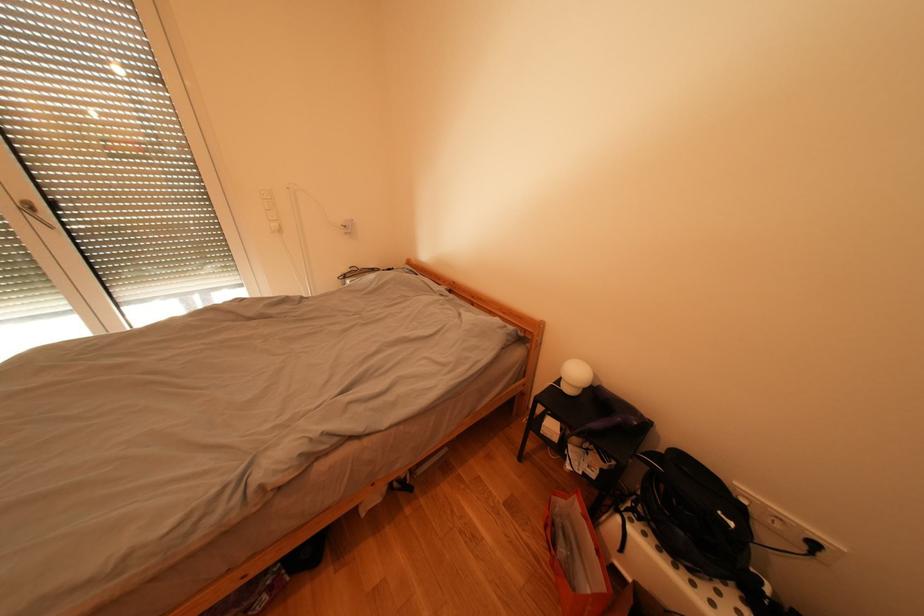
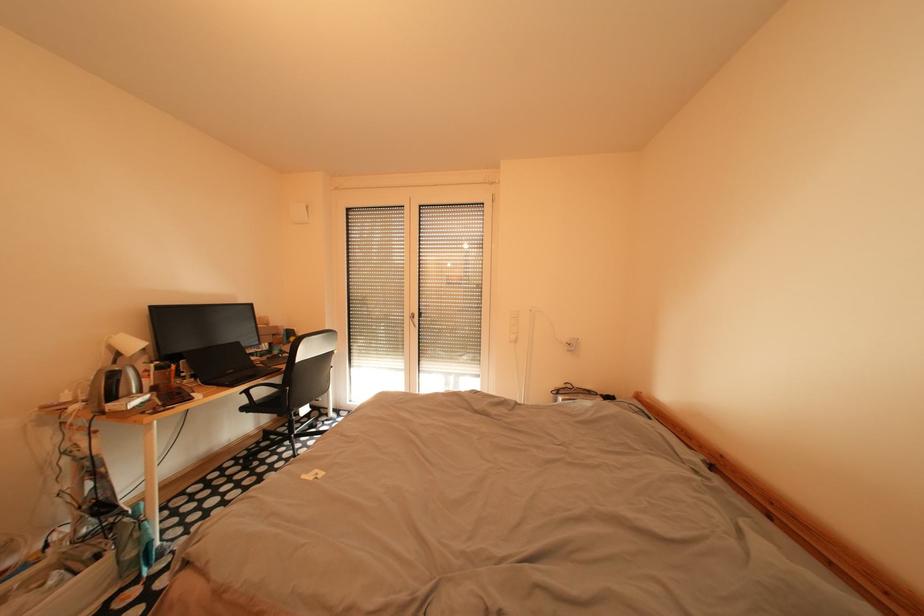
Question: Based on the continuous images, in which direction is the camera rotating? Reply with the corresponding letter.

Choices:
 (A) Left
 (B) Right
 (C) Up
 (D) Down

Answer: (A)